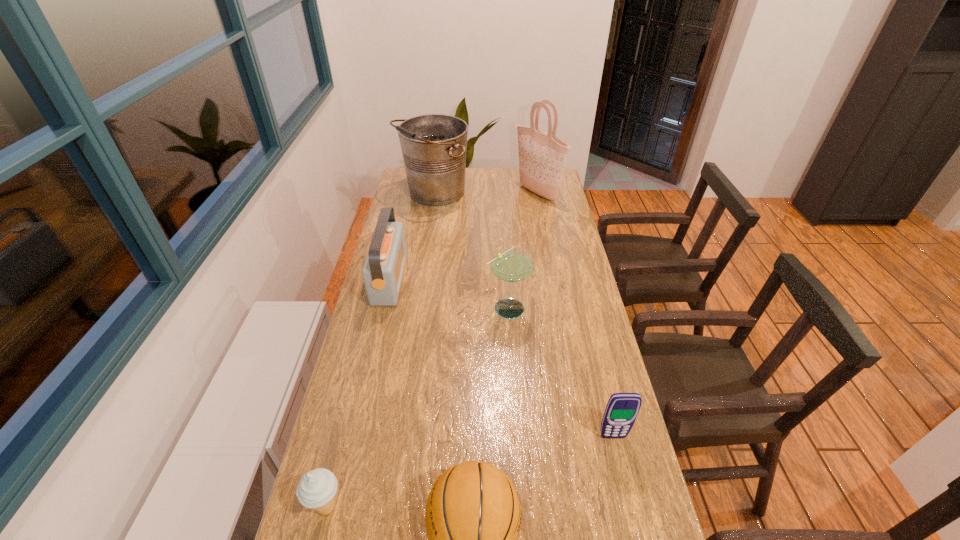
I want to click on free space located 0.110m on the front-facing side of the third nearest object, so click(624, 483).

Image resolution: width=960 pixels, height=540 pixels. I want to click on blank space located on the right of the icecream, so click(412, 507).

Identify the location of shopping bag positioned at the far edge. Image resolution: width=960 pixels, height=540 pixels. (542, 157).

I want to click on bucket situated at the far edge, so click(433, 146).

The height and width of the screenshot is (540, 960). Find the location of `bucket located at the left edge`. bucket located at the left edge is located at coordinates pyautogui.click(x=433, y=146).

I want to click on radio receiver located in the left edge section of the desktop, so click(x=383, y=269).

Where is `icecream that is at the left edge`? The width and height of the screenshot is (960, 540). icecream that is at the left edge is located at coordinates (317, 488).

The width and height of the screenshot is (960, 540). I want to click on shopping bag located in the right edge section of the desktop, so click(542, 157).

You are a GUI agent. You are given a task and a screenshot of the screen. Output one action in this format:
    pyautogui.click(x=<x>, y=<y>)
    Task: Click on the cellular telephone at the right edge
    
    Given the screenshot: What is the action you would take?
    pyautogui.click(x=622, y=409)

I want to click on object present at the far left corner, so click(x=433, y=146).